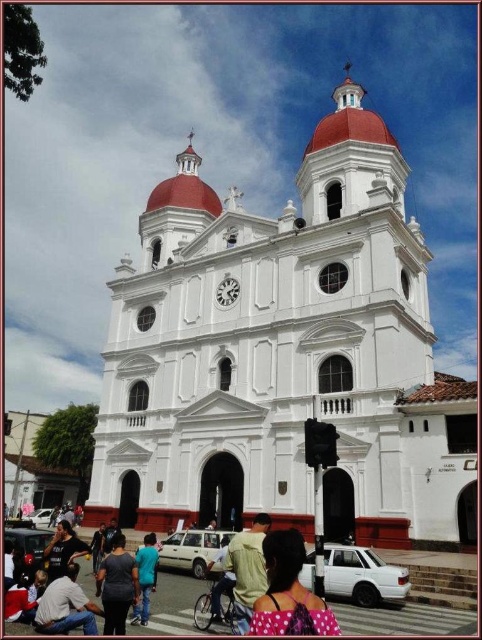
Based on the photo, which is more to the left, polka dot fabric at lower center or dark blue shirt at lower left?

Positioned to the left is dark blue shirt at lower left.

Does polka dot fabric at lower center have a lesser height compared to dark blue shirt at lower left?

No.

Does point (321, 620) come in front of point (106, 593)?

Yes.

Where is `polka dot fabric at lower center`? The width and height of the screenshot is (482, 640). polka dot fabric at lower center is located at coordinates pos(289,593).

Based on the photo, can you confirm if matte black shirt at lower left is positioned below dark blue shirt at lower left?

No.

Looking at this image, is matte black shirt at lower left shorter than dark blue shirt at lower left?

Indeed, matte black shirt at lower left has a lesser height compared to dark blue shirt at lower left.

Locate an element on the screen. The image size is (482, 640). matte black shirt at lower left is located at coordinates (66, 605).

Is point (57, 620) behind point (154, 586)?

No, (57, 620) is closer to viewer.

Is point (52, 596) more distant than point (154, 573)?

No.

Find the location of a particular element. This screenshot has width=482, height=640. matte black shirt at lower left is located at coordinates (66, 605).